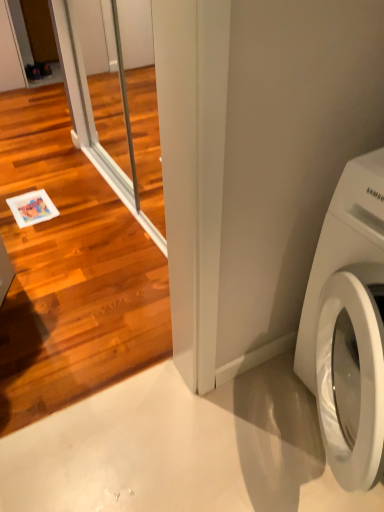
Question: Is clear glass screen door at upper left, which ranks as the second screen door in back-to-front order, to the right of clear glass screen door at left, positioned as the first screen door in back-to-front order, from the viewer's perspective?

Choices:
 (A) yes
 (B) no

Answer: (A)

Question: Is clear glass screen door at upper left, the 1th screen door positioned from the front, thinner than clear glass screen door at left, arranged as the second screen door when viewed from the front?

Choices:
 (A) yes
 (B) no

Answer: (B)

Question: Does clear glass screen door at upper left, the 1th screen door positioned from the front, have a lesser height compared to clear glass screen door at left, arranged as the second screen door when viewed from the front?

Choices:
 (A) no
 (B) yes

Answer: (A)

Question: Is clear glass screen door at upper left, the 1th screen door positioned from the front, smaller than clear glass screen door at left, positioned as the first screen door in back-to-front order?

Choices:
 (A) no
 (B) yes

Answer: (B)

Question: Is clear glass screen door at upper left, the 1th screen door positioned from the front, facing towards clear glass screen door at left, arranged as the second screen door when viewed from the front?

Choices:
 (A) yes
 (B) no

Answer: (B)

Question: Would you consider clear glass screen door at upper left, which ranks as the second screen door in back-to-front order, to be distant from clear glass screen door at left, arranged as the second screen door when viewed from the front?

Choices:
 (A) yes
 (B) no

Answer: (B)

Question: Does white glossy washing machine at lower right have a lesser width compared to clear glass screen door at upper left, which ranks as the second screen door in back-to-front order?

Choices:
 (A) no
 (B) yes

Answer: (A)

Question: Is white glossy washing machine at lower right positioned in front of clear glass screen door at upper left, the 1th screen door positioned from the front?

Choices:
 (A) yes
 (B) no

Answer: (B)

Question: Can you confirm if white glossy washing machine at lower right is smaller than clear glass screen door at upper left, the 1th screen door positioned from the front?

Choices:
 (A) yes
 (B) no

Answer: (B)

Question: From the image's perspective, does white glossy washing machine at lower right appear higher than clear glass screen door at upper left, the 1th screen door positioned from the front?

Choices:
 (A) yes
 (B) no

Answer: (B)

Question: Is white glossy washing machine at lower right facing towards clear glass screen door at upper left, the 1th screen door positioned from the front?

Choices:
 (A) no
 (B) yes

Answer: (A)

Question: Would you say white glossy washing machine at lower right is outside clear glass screen door at upper left, which ranks as the second screen door in back-to-front order?

Choices:
 (A) yes
 (B) no

Answer: (A)

Question: Can you confirm if clear glass screen door at upper left, which ranks as the second screen door in back-to-front order, is taller than white glossy washing machine at lower right?

Choices:
 (A) no
 (B) yes

Answer: (B)